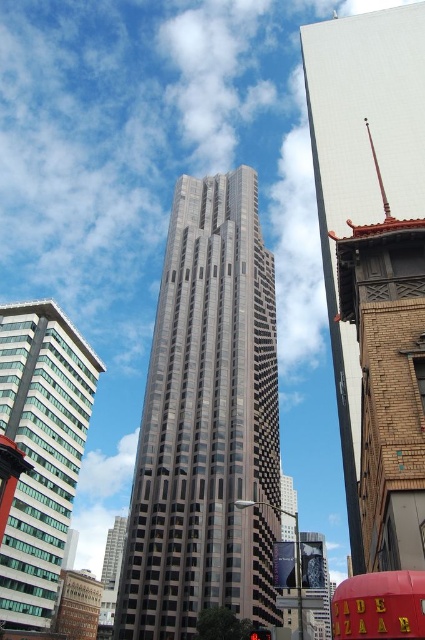
Is green glass building at left in front of red inflatable sign at center?

No, green glass building at left is behind red inflatable sign at center.

From the picture: Does green glass building at left come behind red inflatable sign at center?

Yes.

You are a GUI agent. You are given a task and a screenshot of the screen. Output one action in this format:
    pyautogui.click(x=<x>, y=<y>)
    Task: Click on the green glass building at left
    
    Given the screenshot: What is the action you would take?
    pyautogui.click(x=40, y=449)

In the scene shown: Does shiny glass skyscraper at center appear on the left side of red inflatable sign at center?

Indeed, shiny glass skyscraper at center is positioned on the left side of red inflatable sign at center.

Who is more forward, (248, 518) or (388, 618)?

Point (388, 618)

Where is `shiny glass skyscraper at center`? This screenshot has width=425, height=640. shiny glass skyscraper at center is located at coordinates (206, 422).

Between glassy steel skyscraper at center and green glass building at left, which one is positioned lower?

green glass building at left is lower down.

Is glassy steel skyscraper at center bigger than green glass building at left?

Yes.

Describe the element at coordinates (362, 164) in the screenshot. I see `glassy steel skyscraper at center` at that location.

Where is `glassy steel skyscraper at center`? The image size is (425, 640). glassy steel skyscraper at center is located at coordinates (362, 164).